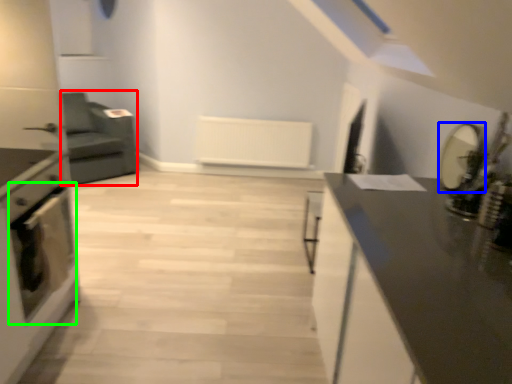
Question: Which object is the closest to the armchair (highlighted by a red box)? Choose among these: appliance (highlighted by a blue box) or oven (highlighted by a green box).

Choices:
 (A) appliance
 (B) oven

Answer: (B)